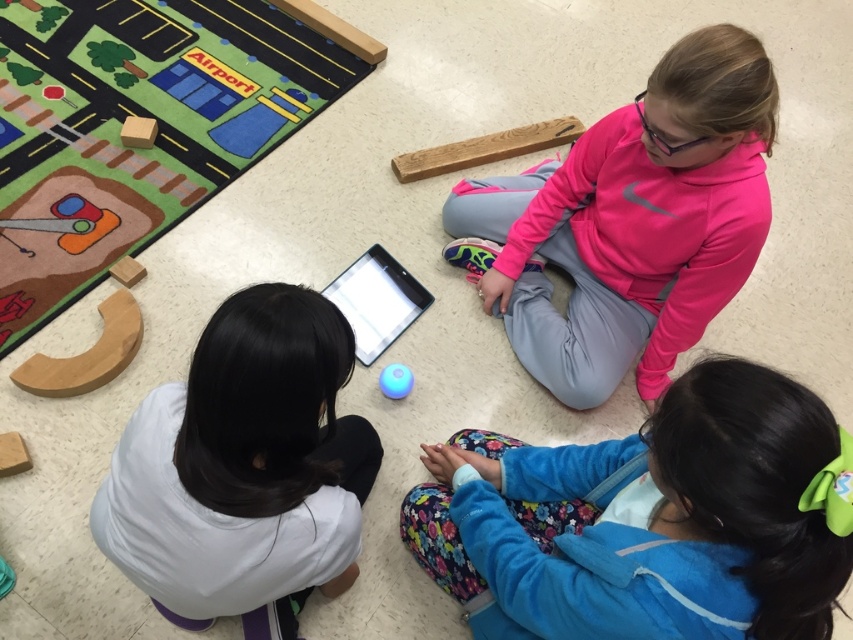
You are a teacher in the classroom. You need to hand out a worksheet to the child wearing the blue fleece jacket at lower right and the child with the black glossy tablet at center. Which child is closer to the front of the classroom?

The blue fleece jacket at lower right is in front of the black glossy tablet at center, so the child wearing the blue fleece jacket at lower right is closer to the front of the classroom.

You are a child sitting at the point with coordinates (283,524) in the classroom. Your friend is holding a tablet 3.55 feet away from you. Can you reach the tablet without moving your legs?

The distance between you and the tablet is 3.55 feet. Since the average arm span for a child is about 2.5 to 3 feet, you would not be able to reach the tablet without moving your legs.